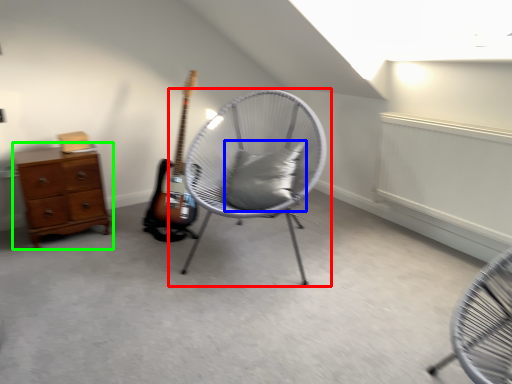
Question: Which object is the farthest from chair (highlighted by a red box)? Choose among these: pillow (highlighted by a blue box) or chest of drawers (highlighted by a green box).

Choices:
 (A) pillow
 (B) chest of drawers

Answer: (B)